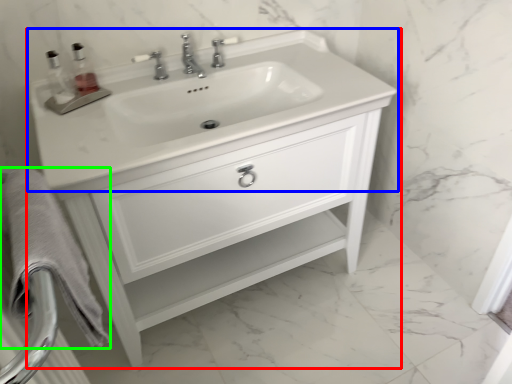
Question: Estimate the real-world distances between objects in this image. Which object is closer to bathroom cabinet (highlighted by a red box), sink (highlighted by a blue box) or bath towel (highlighted by a green box)?

Choices:
 (A) sink
 (B) bath towel

Answer: (A)